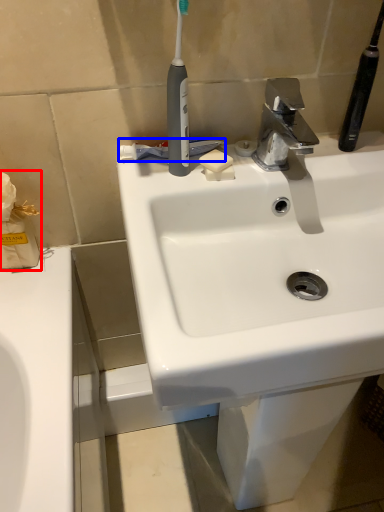
Question: Which object appears farthest to the camera in this image, tissue (highlighted by a red box) or toothpaste (highlighted by a blue box)?

Choices:
 (A) tissue
 (B) toothpaste

Answer: (B)